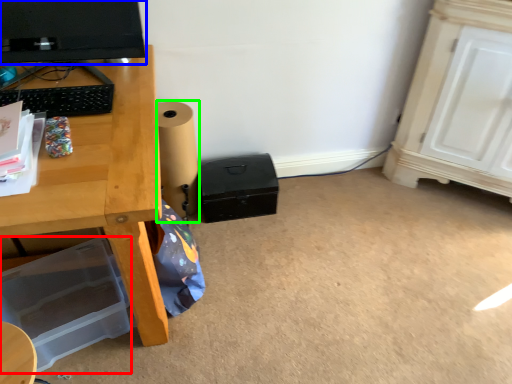
Question: Considering the real-world distances, which object is farthest from box (highlighted by a red box)? computer monitor (highlighted by a blue box) or speaker (highlighted by a green box)?

Choices:
 (A) computer monitor
 (B) speaker

Answer: (A)